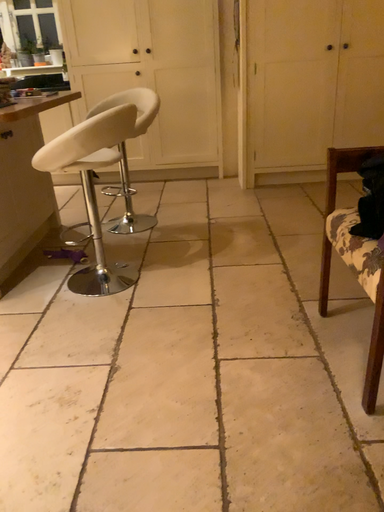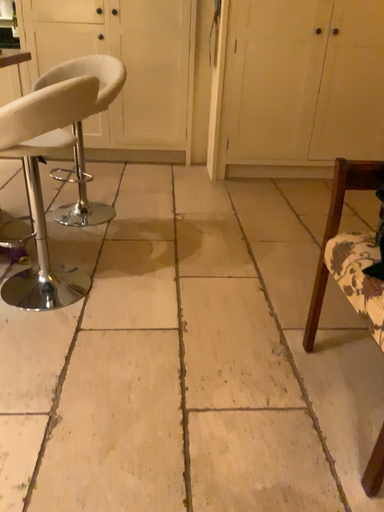
Question: Which way did the camera rotate in the video?

Choices:
 (A) rotated left
 (B) rotated right

Answer: (B)